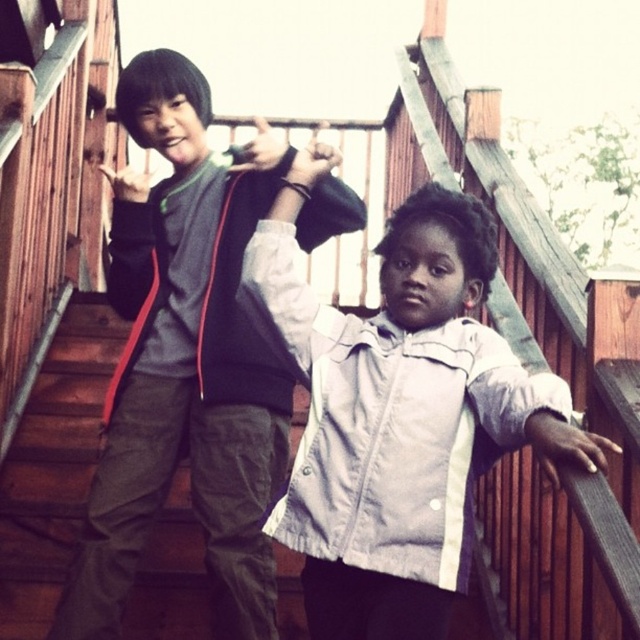
You are a photographer trying to capture both children in a single shot. The white matte jacket at center and dark gray fleece vest at center are both in the frame. Since you want to ensure the shorter one is fully visible, which child should you focus on adjusting the camera angle for?

The white matte jacket at center is shorter than the dark gray fleece vest at center. To ensure the shorter child is fully visible, adjust the camera angle to focus on the white matte jacket at center.

You are a photographer trying to capture a candid shot of the two children. The camera you are using has a maximum focus range of 5 feet. Given that the white matte jacket at center is worn by one of the children, can you take a clear photo of both children without moving the camera?

The two children are 4.73 feet apart, which is within the camera maximum focus range of 5 feet. Therefore, you can take a clear photo of both children without moving the camera.